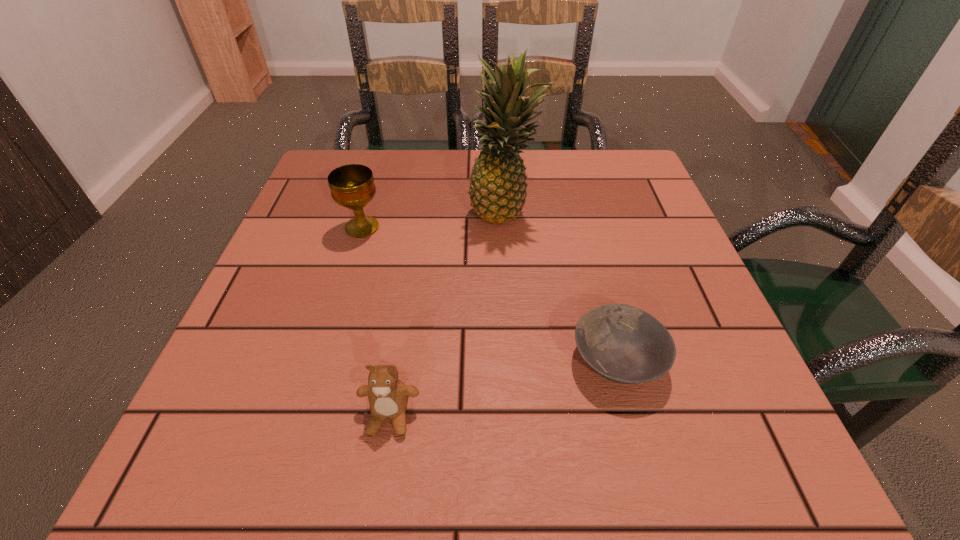
This screenshot has height=540, width=960. Identify the location of free space located on the back of the rightmost object. (601, 298).

I want to click on object present at the far edge, so [x=498, y=185].

This screenshot has width=960, height=540. I want to click on object that is positioned at the near edge, so coord(388,396).

Locate an element on the screen. object that is at the left edge is located at coordinates (352, 186).

You are a GUI agent. You are given a task and a screenshot of the screen. Output one action in this format:
    pyautogui.click(x=<x>, y=<y>)
    Task: Click on the object that is at the right edge
    The image size is (960, 540).
    Given the screenshot: What is the action you would take?
    pyautogui.click(x=622, y=343)

You are a GUI agent. You are given a task and a screenshot of the screen. Output one action in this format:
    pyautogui.click(x=<x>, y=<y>)
    Task: Click on the blank space at the far edge of the desktop
    
    Given the screenshot: What is the action you would take?
    pyautogui.click(x=564, y=176)

You are a GUI agent. You are given a task and a screenshot of the screen. Output one action in this format:
    pyautogui.click(x=<x>, y=<y>)
    Task: Click on the blank space at the near edge of the desktop
    This screenshot has width=960, height=540.
    Given the screenshot: What is the action you would take?
    pyautogui.click(x=643, y=441)

Identify the location of free region at the left edge of the desktop. This screenshot has width=960, height=540. (323, 248).

I want to click on free location at the right edge of the desktop, so click(706, 417).

In the image, there is a desktop. Where is `free space at the far left corner`? This screenshot has width=960, height=540. free space at the far left corner is located at coordinates click(x=376, y=171).